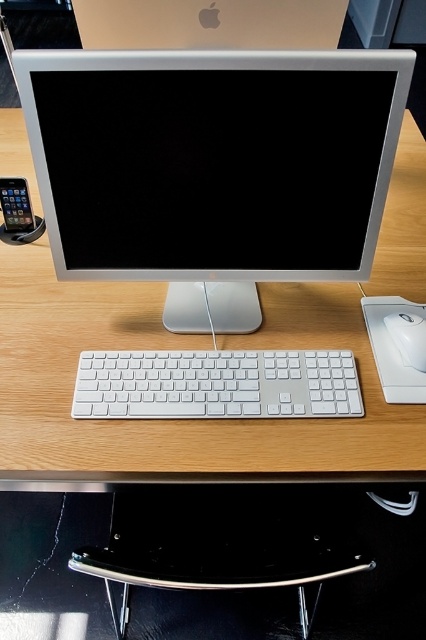
You are setting up a new monitor stand that requires 16 inches of space between the desk edge and the mouse. Based on the current setup shown, can the white plastic mouse at lower right stay in its current position relative to the wooden desk at center?

The wooden desk at center is only 14.97 inches from the white plastic mouse at lower right, which is less than the required 16 inches. Therefore, the white plastic mouse at lower right cannot stay in its current position as it does not meet the space requirement.

Looking at this image, you need to place a new wireless charger on the desk without moving the white plastic keyboard at center. Where should you place it to ensure it doesn not interfere with the keyboard?

The white plastic keyboard at center is located at point (x=216, y=385). To avoid interference, place the wireless charger in an area not overlapping with these coordinates, such as near the edges or corners of the desk surface.

You are organizing your workspace and need to place a new 15cm wide laptop between the wooden desk at center and the white plastic keyboard at center. Can the laptop fit horizontally between them?

The wooden desk at center might be wider than white plastic keyboard at center, but the exact width difference isn